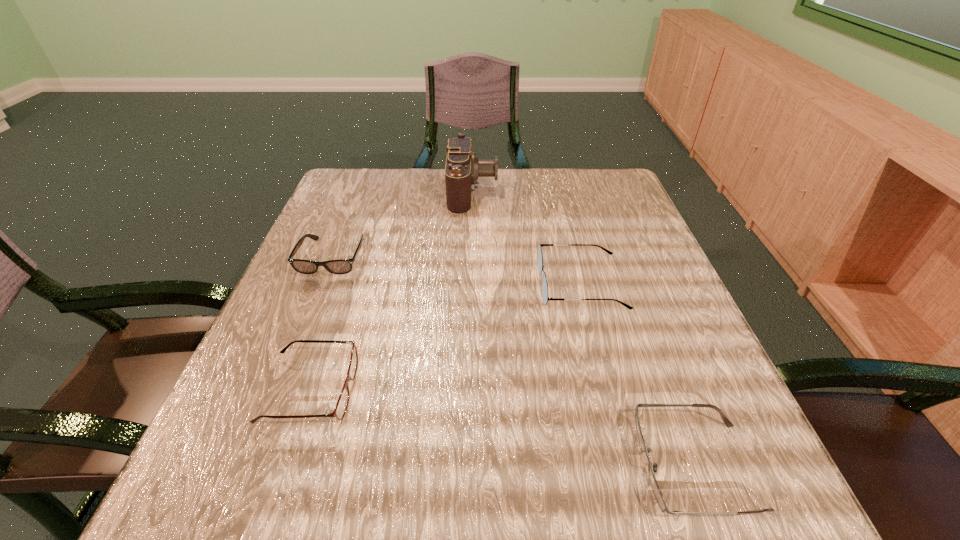
Find the location of `vacant space at the far right corner of the desktop`. vacant space at the far right corner of the desktop is located at coordinates (619, 194).

You are a GUI agent. You are given a task and a screenshot of the screen. Output one action in this format:
    pyautogui.click(x=<x>, y=<y>)
    Task: Click on the object that stands as the third closest to the camera
    The height and width of the screenshot is (540, 960).
    Given the screenshot: What is the action you would take?
    pyautogui.click(x=341, y=407)

The width and height of the screenshot is (960, 540). What are the coordinates of `object identified as the third closest to the farthest object` in the screenshot? It's located at (341, 407).

Locate an element on the screen. The image size is (960, 540). the closest spectacles to the camera is located at coordinates (540, 257).

Select which spectacles is the closest to the farthest object. Please provide its 2D coordinates. Your answer should be formatted as a tuple, i.e. [(x, y)], where the tuple contains the x and y coordinates of a point satisfying the conditions above.

[(540, 257)]